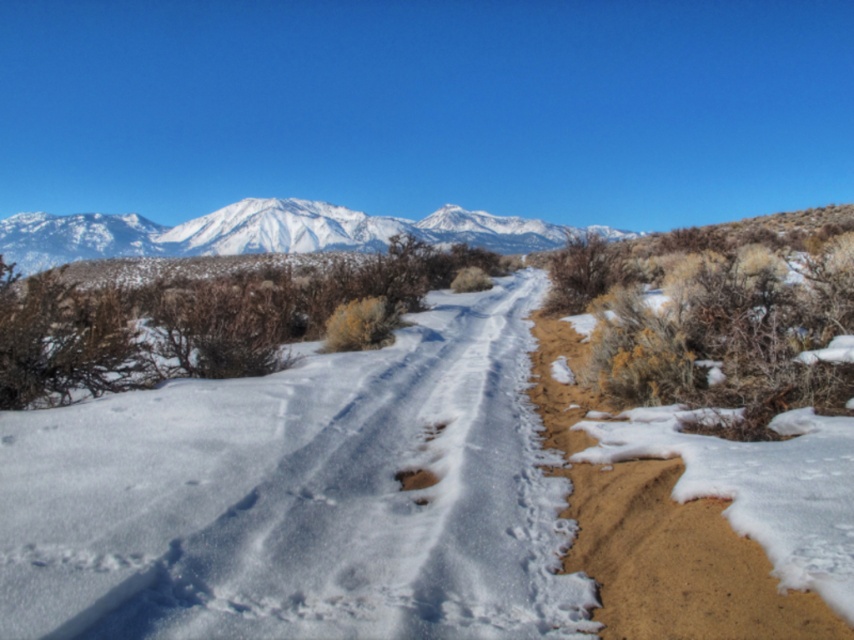
What do you see at coordinates (265, 232) in the screenshot? I see `snowy white mountain range at upper center` at bounding box center [265, 232].

Can you confirm if snowy white mountain range at upper center is positioned below brown dirt footprint at center?

No, snowy white mountain range at upper center is not below brown dirt footprint at center.

Who is more distant from viewer, (214, 212) or (396, 477)?

Point (214, 212)

Locate an element on the screen. The width and height of the screenshot is (854, 640). snowy white mountain range at upper center is located at coordinates (265, 232).

Consider the image. Between brown sandy dirt track at right and brown dirt footprint at center, which one has less height?

Standing shorter between the two is brown dirt footprint at center.

Looking at this image, is brown sandy dirt track at right thinner than brown dirt footprint at center?

No, brown sandy dirt track at right is not thinner than brown dirt footprint at center.

Is point (581, 513) less distant than point (408, 483)?

Yes, point (581, 513) is in front of point (408, 483).

This screenshot has width=854, height=640. What are the coordinates of `brown sandy dirt track at right` in the screenshot? It's located at point(677,561).

Can you confirm if brown sandy dirt track at right is taller than snowy white mountain range at upper center?

Incorrect, brown sandy dirt track at right's height is not larger of snowy white mountain range at upper center's.

What do you see at coordinates (677, 561) in the screenshot? The image size is (854, 640). I see `brown sandy dirt track at right` at bounding box center [677, 561].

The image size is (854, 640). I want to click on brown sandy dirt track at right, so [x=677, y=561].